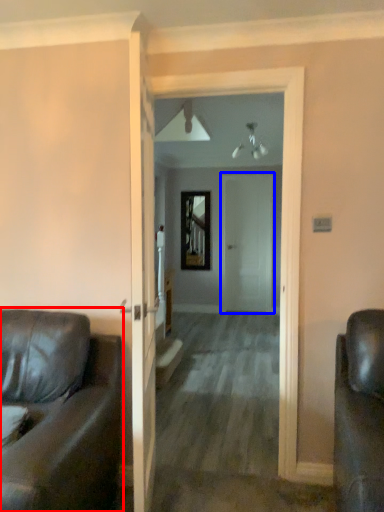
Question: Among these objects, which one is nearest to the camera, studio couch (highlighted by a red box) or door (highlighted by a blue box)?

Choices:
 (A) studio couch
 (B) door

Answer: (A)